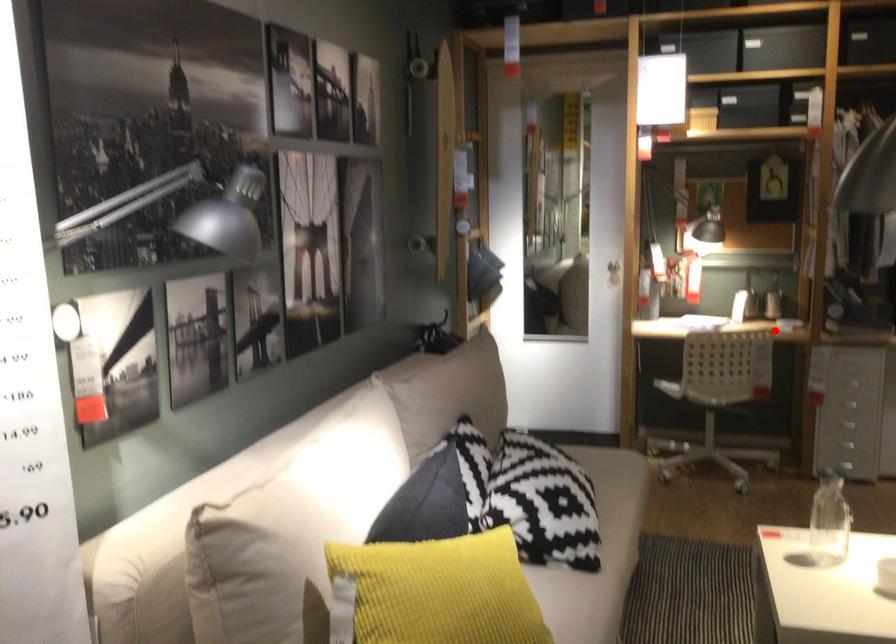
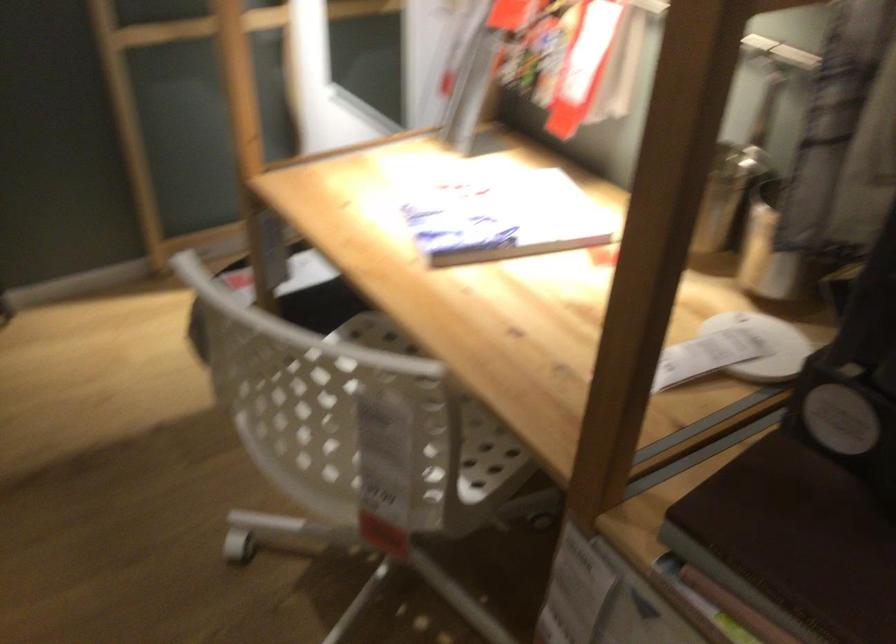
Find the pixel in the second image that matches the highlighted location in the first image.

(371, 418)